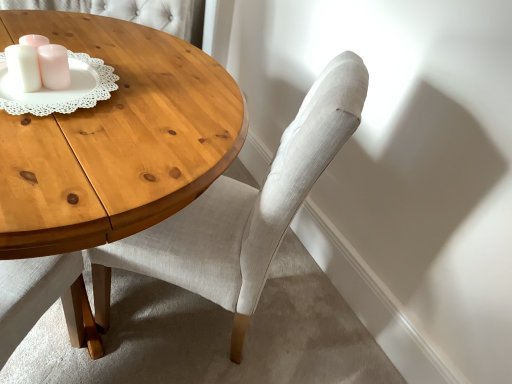
Question: From a real-world perspective, is light gray fabric chair at center positioned above or below white matte candle holder at upper left?

Choices:
 (A) above
 (B) below

Answer: (B)

Question: In the image, is light gray fabric chair at center positioned in front of or behind white matte candle holder at upper left?

Choices:
 (A) behind
 (B) front

Answer: (B)

Question: Would you say light gray fabric chair at center is to the left or to the right of white matte candle holder at upper left in the picture?

Choices:
 (A) left
 (B) right

Answer: (B)

Question: Relative to light gray fabric chair at center, is white matte candle holder at upper left in front or behind?

Choices:
 (A) behind
 (B) front

Answer: (A)

Question: Considering the positions of white matte candle holder at upper left and light gray fabric chair at center in the image, is white matte candle holder at upper left wider or thinner than light gray fabric chair at center?

Choices:
 (A) thin
 (B) wide

Answer: (A)

Question: Based on their positions, is white matte candle holder at upper left located to the left or right of light gray fabric chair at center?

Choices:
 (A) left
 (B) right

Answer: (A)

Question: Does point (11, 51) appear closer or farther from the camera than point (135, 261)?

Choices:
 (A) farther
 (B) closer

Answer: (B)